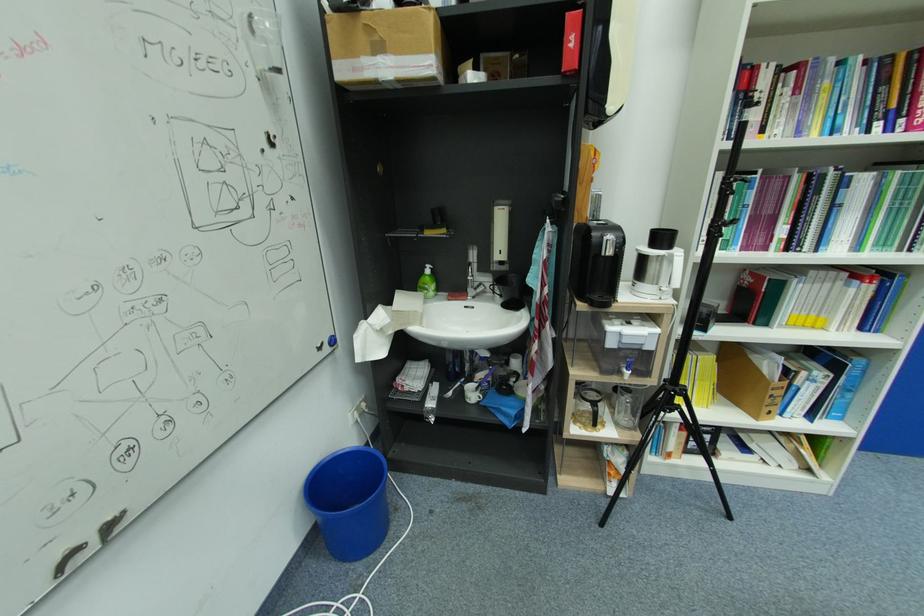
You are a GUI agent. You are given a task and a screenshot of the screen. Output one action in this format:
    pyautogui.click(x=<x>, y=<y>)
    Task: Click on the blue plastic bin
    The width and height of the screenshot is (924, 616).
    Given the screenshot: What is the action you would take?
    pyautogui.click(x=349, y=501)